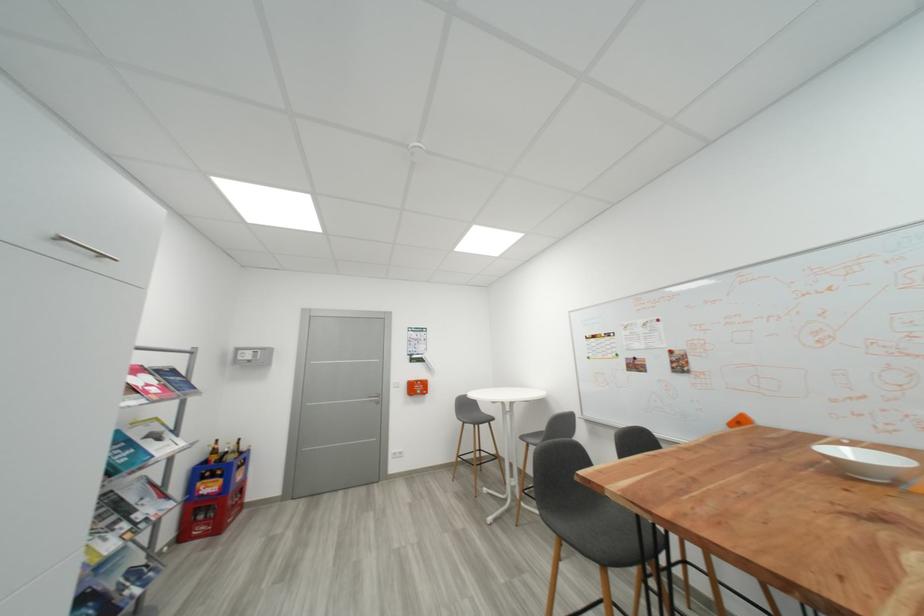
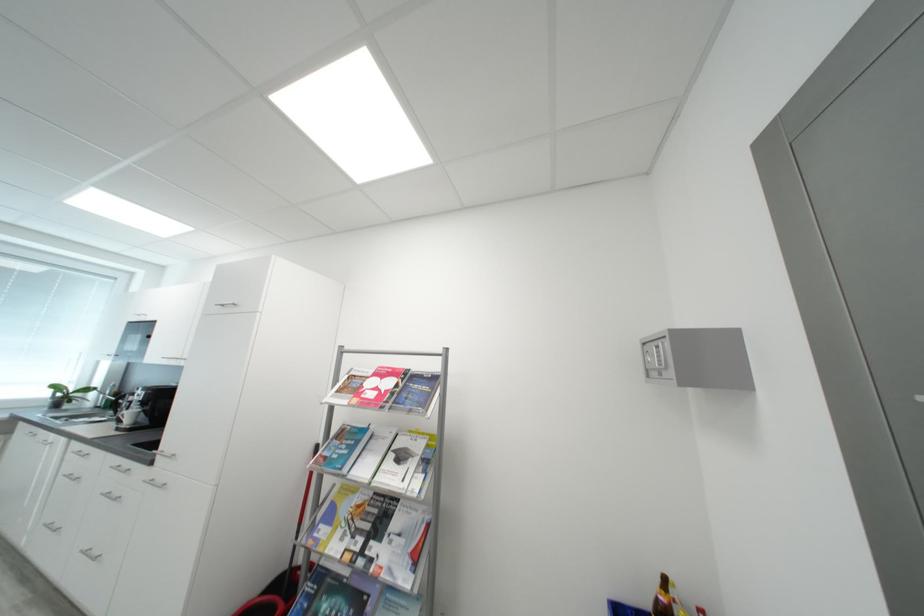
Find the pixel in the second image that matches the point at 146,517 in the first image.

(380, 549)